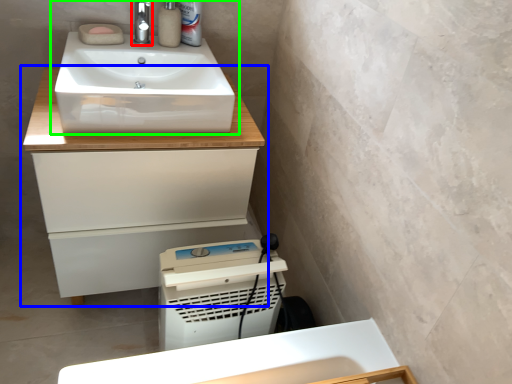
Question: Estimate the real-world distances between objects in this image. Which object is farther from tap (highlighted by a red box), bathroom cabinet (highlighted by a blue box) or sink (highlighted by a green box)?

Choices:
 (A) bathroom cabinet
 (B) sink

Answer: (A)